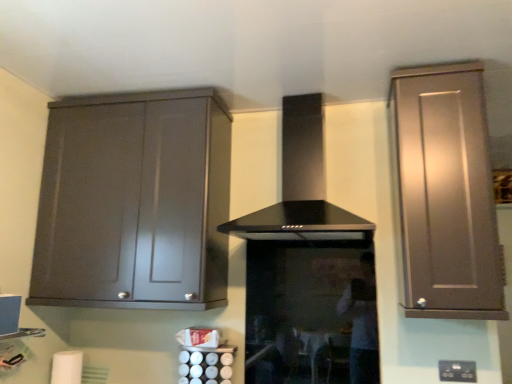
Question: Could you tell me if satin silver canisters at lower center is facing white matte toilet paper at lower left?

Choices:
 (A) yes
 (B) no

Answer: (B)

Question: Is satin silver canisters at lower center positioned with its back to white matte toilet paper at lower left?

Choices:
 (A) yes
 (B) no

Answer: (B)

Question: Does satin silver canisters at lower center appear on the left side of white matte toilet paper at lower left?

Choices:
 (A) no
 (B) yes

Answer: (A)

Question: Can you confirm if satin silver canisters at lower center is shorter than white matte toilet paper at lower left?

Choices:
 (A) yes
 (B) no

Answer: (A)

Question: Is satin silver canisters at lower center positioned beyond the bounds of white matte toilet paper at lower left?

Choices:
 (A) no
 (B) yes

Answer: (B)

Question: From the image's perspective, is matte gray cabinet at left, the first cabinetry when ordered from left to right, located above or below black glass range hood at center?

Choices:
 (A) below
 (B) above

Answer: (A)

Question: From a real-world perspective, relative to black glass range hood at center, is matte gray cabinet at left, the 2th cabinetry when ordered from right to left, vertically above or below?

Choices:
 (A) below
 (B) above

Answer: (A)

Question: Is matte gray cabinet at left, the 2th cabinetry when ordered from right to left, to the left or to the right of black glass range hood at center in the image?

Choices:
 (A) right
 (B) left

Answer: (B)

Question: From their relative heights in the image, would you say matte gray cabinet at left, the 2th cabinetry when ordered from right to left, is taller or shorter than black glass range hood at center?

Choices:
 (A) tall
 (B) short

Answer: (A)

Question: Is point (174, 248) closer or farther from the camera than point (441, 375)?

Choices:
 (A) farther
 (B) closer

Answer: (A)

Question: From their relative heights in the image, would you say matte gray cabinet at left, the 2th cabinetry when ordered from right to left, is taller or shorter than black plastic electric outlet at lower right?

Choices:
 (A) short
 (B) tall

Answer: (B)

Question: Considering the relative positions of matte gray cabinet at left, the 2th cabinetry when ordered from right to left, and black plastic electric outlet at lower right in the image provided, is matte gray cabinet at left, the 2th cabinetry when ordered from right to left, to the left or to the right of black plastic electric outlet at lower right?

Choices:
 (A) left
 (B) right

Answer: (A)

Question: In the image, is matte gray cabinet at left, the 2th cabinetry when ordered from right to left, positioned in front of or behind black plastic electric outlet at lower right?

Choices:
 (A) front
 (B) behind

Answer: (A)

Question: Visually, is white matte toilet paper at lower left positioned to the left or to the right of satin silver canisters at lower center?

Choices:
 (A) right
 (B) left

Answer: (B)

Question: From a real-world perspective, relative to satin silver canisters at lower center, is white matte toilet paper at lower left vertically above or below?

Choices:
 (A) below
 (B) above

Answer: (A)